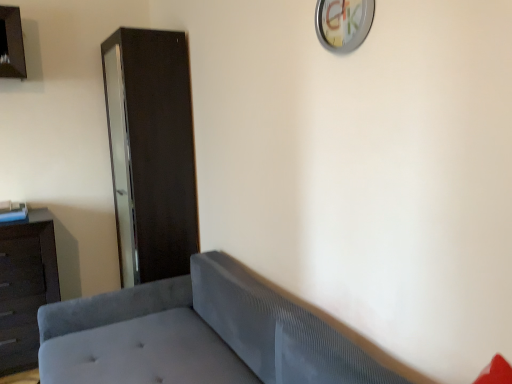
Question: Is matte black cabinet at left thinner than velvet gray studio couch at lower left?

Choices:
 (A) no
 (B) yes

Answer: (B)

Question: Is matte black cabinet at left facing towards velvet gray studio couch at lower left?

Choices:
 (A) yes
 (B) no

Answer: (B)

Question: Is matte black cabinet at left taller than velvet gray studio couch at lower left?

Choices:
 (A) no
 (B) yes

Answer: (B)

Question: Does matte black cabinet at left come behind velvet gray studio couch at lower left?

Choices:
 (A) yes
 (B) no

Answer: (A)

Question: Is matte black cabinet at left placed right next to velvet gray studio couch at lower left?

Choices:
 (A) no
 (B) yes

Answer: (A)

Question: Would you say matte black cabinet at left is outside velvet gray studio couch at lower left?

Choices:
 (A) no
 (B) yes

Answer: (B)

Question: Does matte black cabinet at left touch metallic silver clock at upper center?

Choices:
 (A) no
 (B) yes

Answer: (A)

Question: From a real-world perspective, is matte black cabinet at left under metallic silver clock at upper center?

Choices:
 (A) yes
 (B) no

Answer: (A)

Question: From the image's perspective, is matte black cabinet at left under metallic silver clock at upper center?

Choices:
 (A) yes
 (B) no

Answer: (A)

Question: Is matte black cabinet at left oriented away from metallic silver clock at upper center?

Choices:
 (A) no
 (B) yes

Answer: (A)

Question: Considering the relative sizes of matte black cabinet at left and metallic silver clock at upper center in the image provided, is matte black cabinet at left taller than metallic silver clock at upper center?

Choices:
 (A) yes
 (B) no

Answer: (A)

Question: Is matte black cabinet at left shorter than metallic silver clock at upper center?

Choices:
 (A) yes
 (B) no

Answer: (B)

Question: From the image's perspective, is metallic silver clock at upper center located above dark brown wood dresser at left?

Choices:
 (A) no
 (B) yes

Answer: (B)